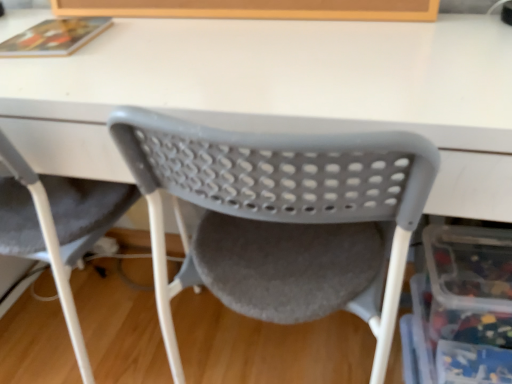
Question: Is point (397, 208) closer or farther from the camera than point (130, 203)?

Choices:
 (A) farther
 (B) closer

Answer: (B)

Question: Is matte plastic chair at center, the 2th chair positioned from the left, wider or thinner than gray plastic chair at lower left, acting as the first chair starting from the left?

Choices:
 (A) wide
 (B) thin

Answer: (A)

Question: Estimate the real-world distances between objects in this image. Which object is closer to the translucent plastic storage box at lower right?

Choices:
 (A) gray plastic chair at lower left, acting as the first chair starting from the left
 (B) matte plastic chair at center, the first chair positioned from the right

Answer: (B)

Question: Considering the real-world distances, which object is farthest from the matte plastic chair at center, the first chair positioned from the right?

Choices:
 (A) gray plastic chair at lower left, marked as the second chair in a right-to-left arrangement
 (B) translucent plastic storage box at lower right

Answer: (A)